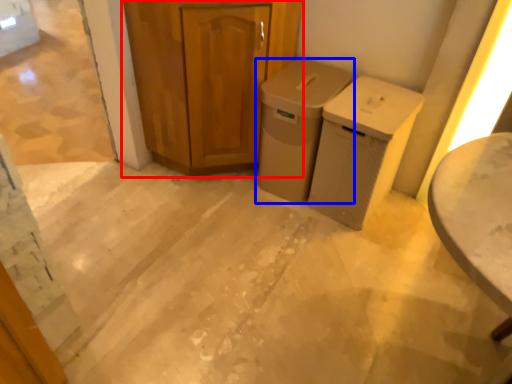
Question: Which object is closer to the camera taking this photo, cabinetry (highlighted by a red box) or waste container (highlighted by a blue box)?

Choices:
 (A) cabinetry
 (B) waste container

Answer: (A)